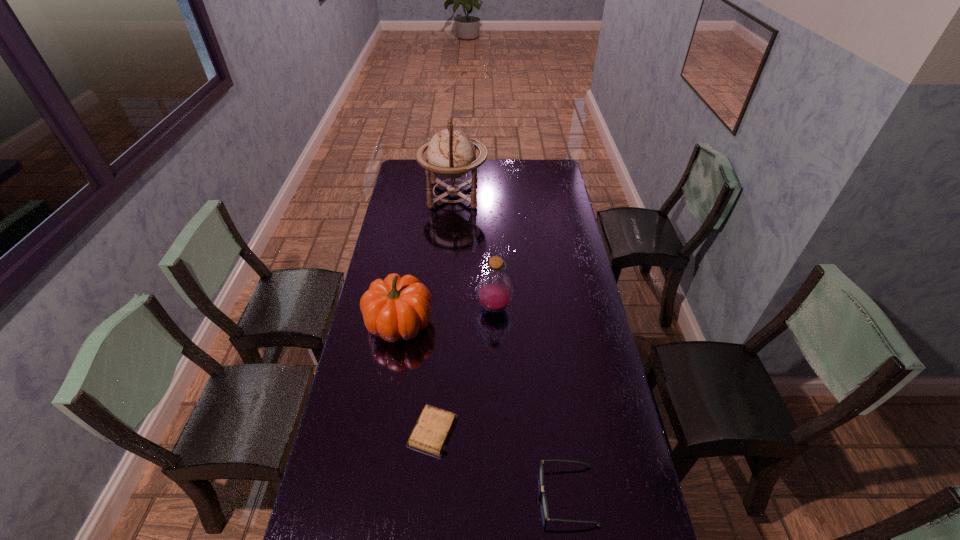
At what (x,y) coordinates should I click in order to perform the action: click on free space located on the right of the pumpkin. Please return your answer as a coordinate pair (x, y). Image resolution: width=960 pixels, height=540 pixels. Looking at the image, I should click on (507, 323).

The image size is (960, 540). I want to click on vacant space located on the face of the nearest object, so (x=451, y=496).

I want to click on vacant space located on the face of the nearest object, so click(x=488, y=496).

The image size is (960, 540). In order to click on free space located on the face of the nearest object in this screenshot , I will do (410, 496).

The height and width of the screenshot is (540, 960). What are the coordinates of `vacant area situated 0.160m on the back of the fourth farthest object` in the screenshot? It's located at (439, 363).

The height and width of the screenshot is (540, 960). Identify the location of object located at the far edge. (451, 153).

Identify the location of globe that is at the left edge. The width and height of the screenshot is (960, 540). (451, 153).

Identify the location of pumpkin that is at the left edge. The height and width of the screenshot is (540, 960). (395, 307).

I want to click on object that is at the right edge, so click(x=544, y=501).

Locate an element on the screen. The image size is (960, 540). object that is at the far left corner is located at coordinates (451, 153).